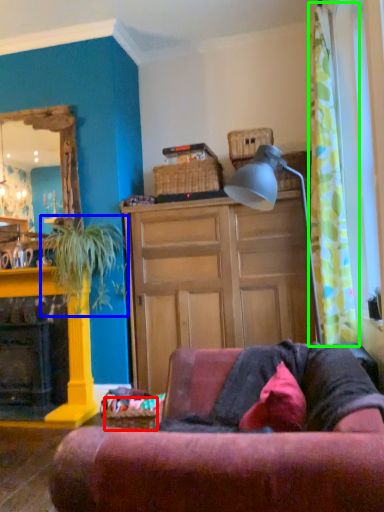
Question: Which object is positioned farthest from picnic basket (highlighted by a red box)? Select from houseplant (highlighted by a blue box) and curtain (highlighted by a green box).

Choices:
 (A) houseplant
 (B) curtain

Answer: (B)